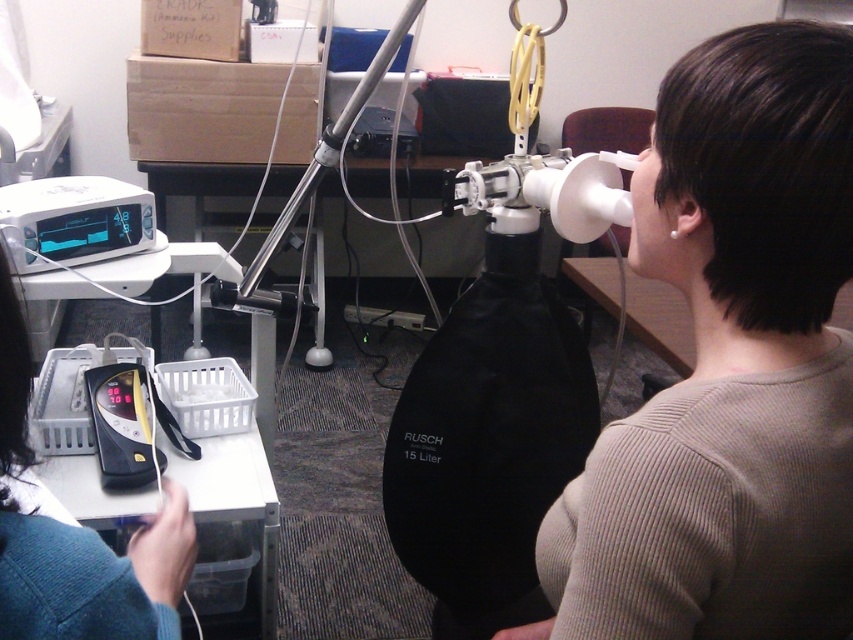
Can you confirm if teal knit sweater at lower left is bigger than white plastic monitor at upper left?

Indeed, teal knit sweater at lower left has a larger size compared to white plastic monitor at upper left.

Does point (26, 557) come farther from viewer compared to point (96, 259)?

No, it is in front of (96, 259).

Does point (49, 566) come farther from viewer compared to point (91, 177)?

No, (49, 566) is in front of (91, 177).

Locate an element on the screen. This screenshot has height=640, width=853. teal knit sweater at lower left is located at coordinates (91, 573).

Can you confirm if matte white mask at upper right is wider than silver metallic tripod at center?

Incorrect, matte white mask at upper right's width does not surpass silver metallic tripod at center's.

Does point (614, 577) come farther from viewer compared to point (398, 38)?

No, it is in front of (398, 38).

Describe the element at coordinates (729, 365) in the screenshot. I see `matte white mask at upper right` at that location.

Locate an element on the screen. This screenshot has width=853, height=640. matte white mask at upper right is located at coordinates (729, 365).

Between point (10, 241) and point (332, 129), which one is positioned in front?

Point (10, 241) is more forward.

Describe the element at coordinates (74, 220) in the screenshot. This screenshot has height=640, width=853. I see `white plastic monitor at upper left` at that location.

Identify the location of white plastic monitor at upper left. This screenshot has height=640, width=853. (x=74, y=220).